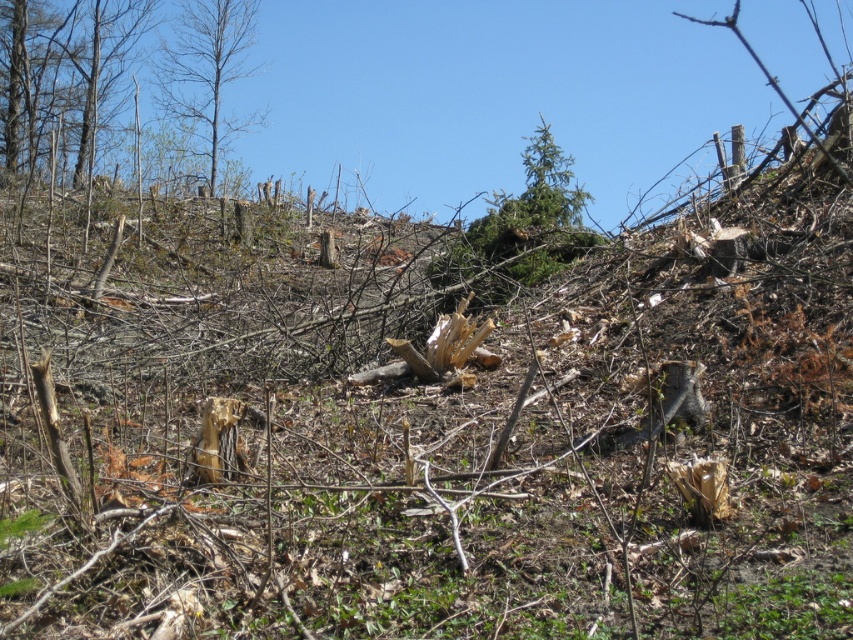
Does smooth bark tree at upper left appear over green leafy tree at upper center?

Yes, smooth bark tree at upper left is above green leafy tree at upper center.

Measure the distance between smooth bark tree at upper left and camera.

smooth bark tree at upper left is 17.81 meters from camera.

Identify the location of smooth bark tree at upper left. Image resolution: width=853 pixels, height=640 pixels. (61, 76).

Can you confirm if green leafy tree at upper center is thinner than bare wood tree at upper left?

Yes.

Is green leafy tree at upper center to the left of bare wood tree at upper left from the viewer's perspective?

Incorrect, green leafy tree at upper center is not on the left side of bare wood tree at upper left.

This screenshot has width=853, height=640. What do you see at coordinates (524, 225) in the screenshot? I see `green leafy tree at upper center` at bounding box center [524, 225].

Where is `green leafy tree at upper center`? The image size is (853, 640). green leafy tree at upper center is located at coordinates [x=524, y=225].

What do you see at coordinates (61, 76) in the screenshot? The height and width of the screenshot is (640, 853). I see `smooth bark tree at upper left` at bounding box center [61, 76].

Based on the photo, can you confirm if smooth bark tree at upper left is positioned to the right of bare wood tree at upper left?

Incorrect, smooth bark tree at upper left is not on the right side of bare wood tree at upper left.

Is point (4, 115) farther from viewer compared to point (236, 77)?

No, it is in front of (236, 77).

Identify the location of smooth bark tree at upper left. (61, 76).